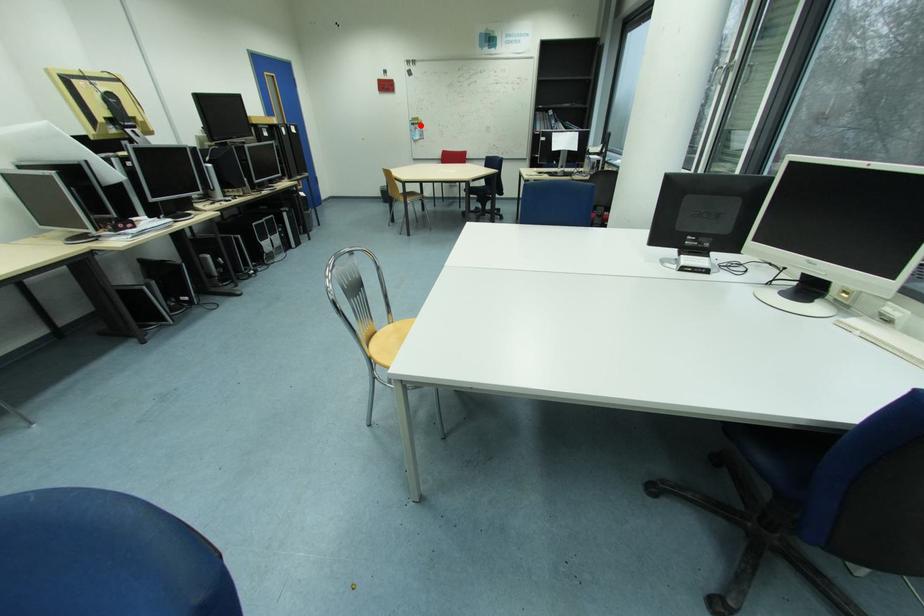
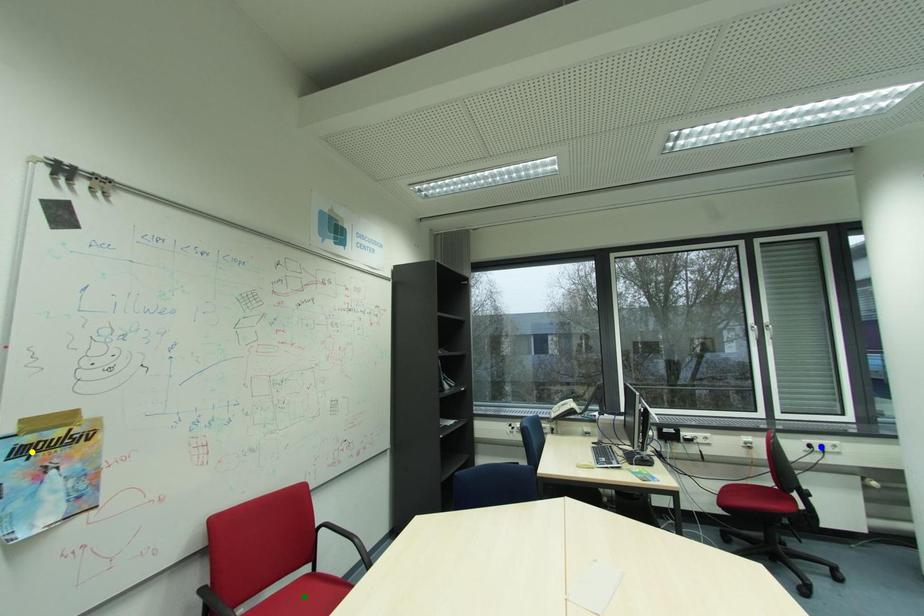
Question: I am providing you with two images of the same scene from different viewpoints. A red point is marked on the first image. You are given multiple points on the second image. Can you choose the point in image 2 that corresponds to the point in image 1?

Choices:
 (A) blue point
 (B) yellow point
 (C) green point

Answer: (B)